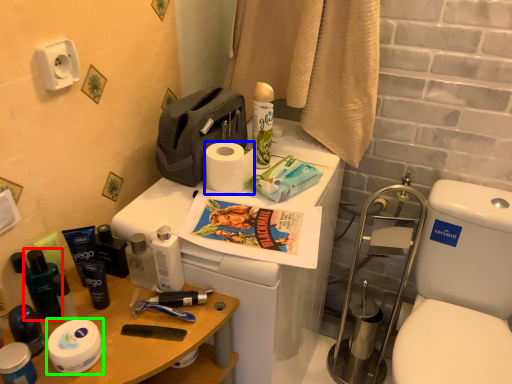
Question: Which object is positioned closest to toiletry (highlighted by a red box)? Select from toilet paper (highlighted by a blue box) and toilet paper (highlighted by a green box).

Choices:
 (A) toilet paper
 (B) toilet paper

Answer: (B)